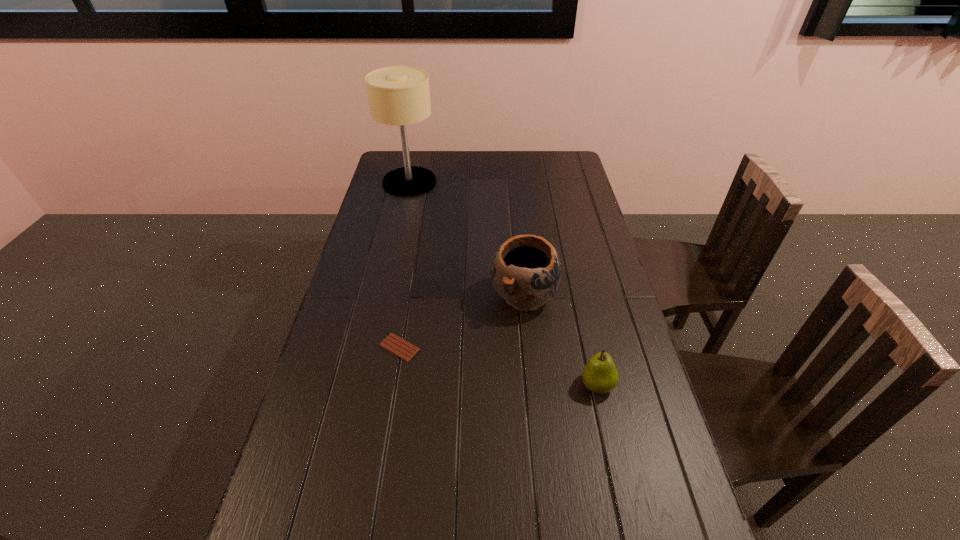
Image resolution: width=960 pixels, height=540 pixels. I want to click on blank space at the far left corner, so click(396, 161).

Where is `free space that is in between the third nearest object and the farthest object`? Image resolution: width=960 pixels, height=540 pixels. free space that is in between the third nearest object and the farthest object is located at coordinates (467, 239).

Locate an element on the screen. free area in between the third object from left to right and the third farthest object is located at coordinates (462, 321).

Identify the location of free point between the farthest object and the candy bar. Image resolution: width=960 pixels, height=540 pixels. (404, 265).

The height and width of the screenshot is (540, 960). What are the coordinates of `vacant region between the shortest object and the second tallest object` in the screenshot? It's located at (462, 321).

Identify the location of vacant point located between the third object from left to right and the tallest object. This screenshot has height=540, width=960. (467, 239).

Image resolution: width=960 pixels, height=540 pixels. What are the coordinates of `unoccupied position between the pottery and the pear` in the screenshot? It's located at (561, 340).

Identify the location of free space that is in between the nearest object and the pottery. (561, 340).

The height and width of the screenshot is (540, 960). What are the coordinates of `empty space between the pottery and the second nearest object` in the screenshot? It's located at (462, 321).

Find the location of a particular element. This screenshot has height=540, width=960. free spot between the farthest object and the pottery is located at coordinates (467, 239).